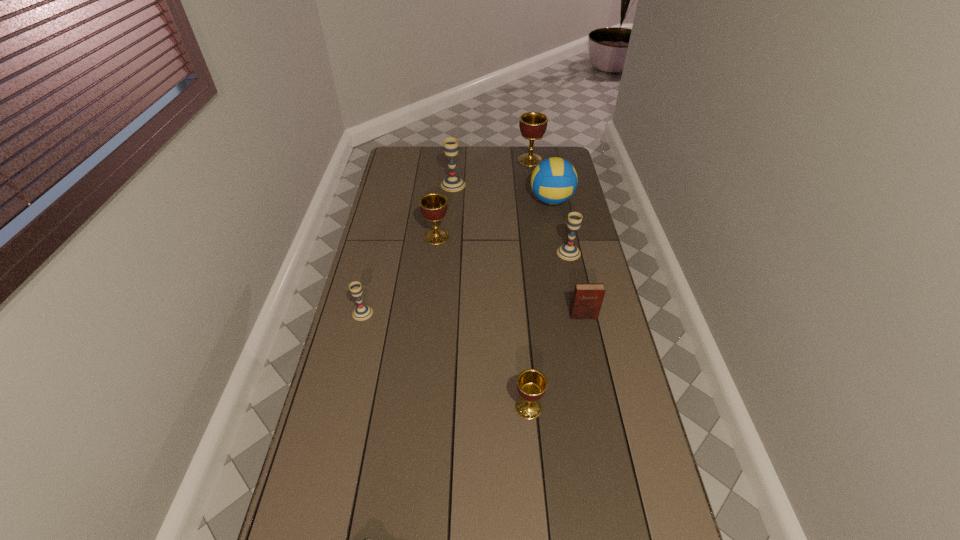
The image size is (960, 540). In order to click on the eighth farthest object in this screenshot , I will do `click(531, 384)`.

I want to click on the smallest golden chalice, so click(x=531, y=384).

Locate an element on the screen. The height and width of the screenshot is (540, 960). the leftmost gray chalice is located at coordinates (362, 312).

Find the location of a particular element. The width and height of the screenshot is (960, 540). the leftmost chalice is located at coordinates (362, 312).

Locate an element on the screen. This screenshot has height=540, width=960. free space located 0.100m on the right of the farthest object is located at coordinates (564, 160).

Image resolution: width=960 pixels, height=540 pixels. I want to click on vacant space located on the right of the biggest gray chalice, so click(x=480, y=185).

This screenshot has width=960, height=540. What are the coordinates of `vacant area situated on the front of the volleyball` in the screenshot? It's located at (561, 247).

Where is `free space located 0.200m on the front of the second nearest gray chalice`? free space located 0.200m on the front of the second nearest gray chalice is located at coordinates (579, 299).

Where is `free space located 0.280m on the front of the second biggest golden chalice`? The height and width of the screenshot is (540, 960). free space located 0.280m on the front of the second biggest golden chalice is located at coordinates (430, 297).

The image size is (960, 540). Find the location of `vacant area situated 0.300m on the front cover of the reddish-brown diary`. vacant area situated 0.300m on the front cover of the reddish-brown diary is located at coordinates (601, 399).